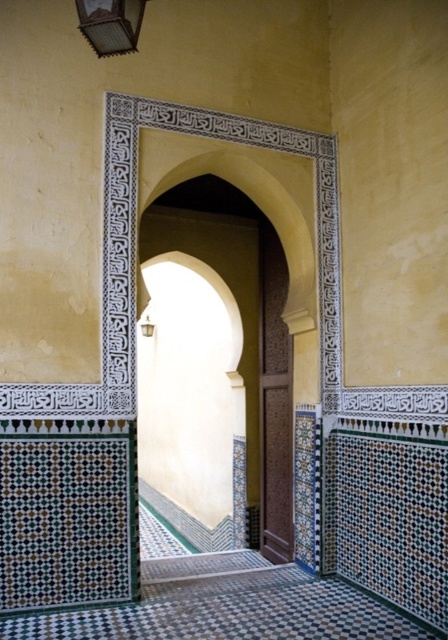
Question: Among these objects, which one is farthest from the camera?

Choices:
 (A) brown carved wood door at center
 (B) metallic glass at upper left

Answer: (A)

Question: Does brown carved wood door at center come in front of metallic glass at upper left?

Choices:
 (A) yes
 (B) no

Answer: (B)

Question: Can you confirm if brown carved wood door at center is wider than metallic glass at upper left?

Choices:
 (A) no
 (B) yes

Answer: (A)

Question: Does brown carved wood door at center have a greater width compared to metallic glass at upper left?

Choices:
 (A) yes
 (B) no

Answer: (B)

Question: Which point appears farthest from the camera in this image?

Choices:
 (A) (289, 452)
 (B) (126, 44)

Answer: (A)